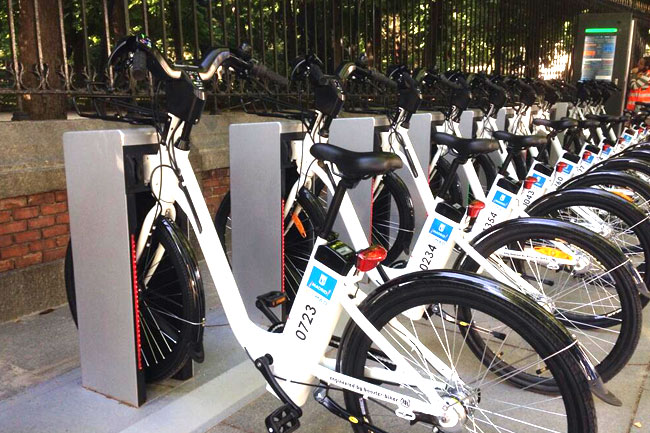
Locate an element on the screen. The height and width of the screenshot is (433, 650). seat cushion is located at coordinates (352, 161), (456, 148), (559, 122), (590, 122), (608, 116), (625, 116), (639, 113).